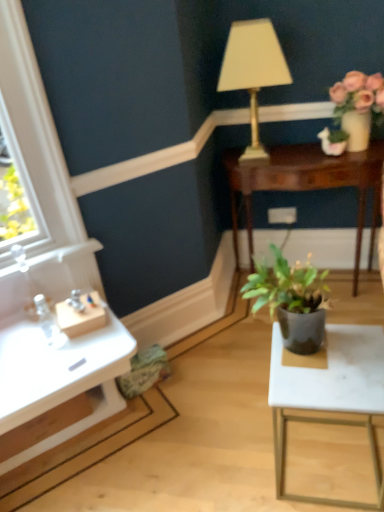
The height and width of the screenshot is (512, 384). I want to click on vacant area located to the right-hand side of green fabric swivel chair at lower center, so click(184, 381).